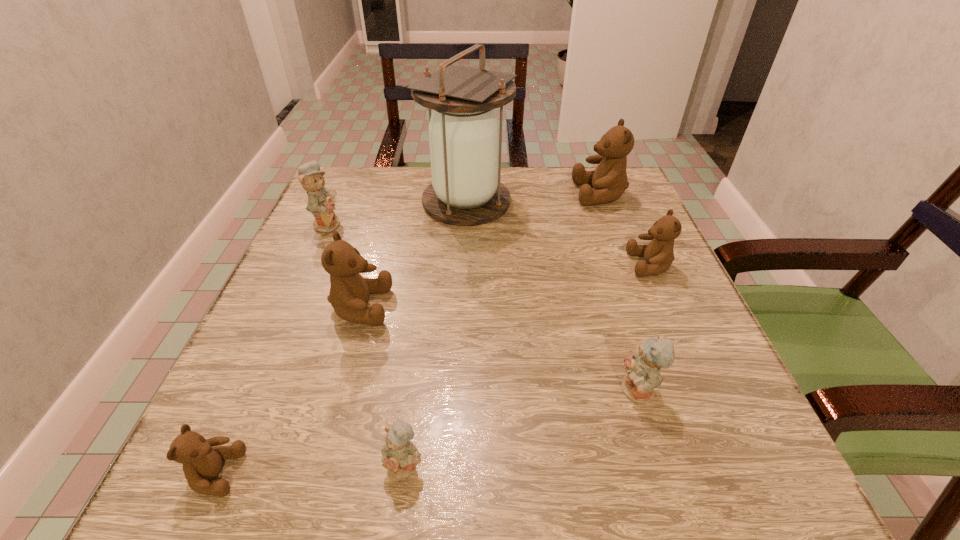
What are the coordinates of `vacant region located on the front-facing side of the biggest blue teddy bear` in the screenshot? It's located at (456, 224).

This screenshot has height=540, width=960. Identify the location of vacant space located 0.270m on the front-facing side of the sixth farthest object. (444, 392).

Identify the location of free location located 0.120m on the front-facing side of the sixth farthest object. pos(542,392).

I want to click on free region located on the front-facing side of the sixth farthest object, so click(405, 392).

This screenshot has width=960, height=540. I want to click on vacant space situated 0.290m on the front-facing side of the second smallest brown teddy bear, so click(487, 265).

Image resolution: width=960 pixels, height=540 pixels. I want to click on vacant point located 0.160m on the front-facing side of the second smallest brown teddy bear, so click(550, 265).

This screenshot has width=960, height=540. I want to click on vacant space located on the front-facing side of the second smallest brown teddy bear, so click(x=506, y=265).

Image resolution: width=960 pixels, height=540 pixels. What are the coordinates of `blank space located 0.210m on the front-facing side of the smallest brown teddy bear` in the screenshot? It's located at (399, 473).

What are the coordinates of `lantern at the far edge` in the screenshot? It's located at (465, 139).

You are a GUI agent. You are given a task and a screenshot of the screen. Output one action in this format:
    pyautogui.click(x=<x>, y=<y>)
    Task: Click on the object at the far left corner
    The width and height of the screenshot is (960, 540).
    Given the screenshot: What is the action you would take?
    pyautogui.click(x=321, y=204)